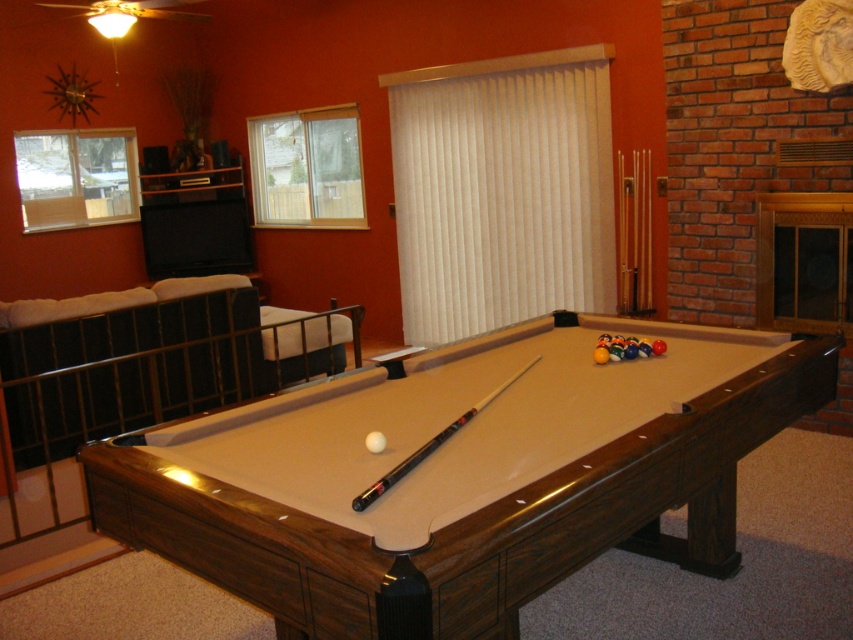
Question: Does brown wood billiard table at center appear over black wood pool cue at center?

Choices:
 (A) no
 (B) yes

Answer: (A)

Question: Which point is closer to the camera taking this photo?

Choices:
 (A) (791, 385)
 (B) (405, 470)

Answer: (B)

Question: Is brown wood billiard table at center positioned behind black wood pool cue at center?

Choices:
 (A) no
 (B) yes

Answer: (A)

Question: Which of the following is the closest to the observer?

Choices:
 (A) black wood pool cue at center
 (B) brown wood billiard table at center

Answer: (B)

Question: Does brown wood billiard table at center appear over black wood pool cue at center?

Choices:
 (A) yes
 (B) no

Answer: (B)